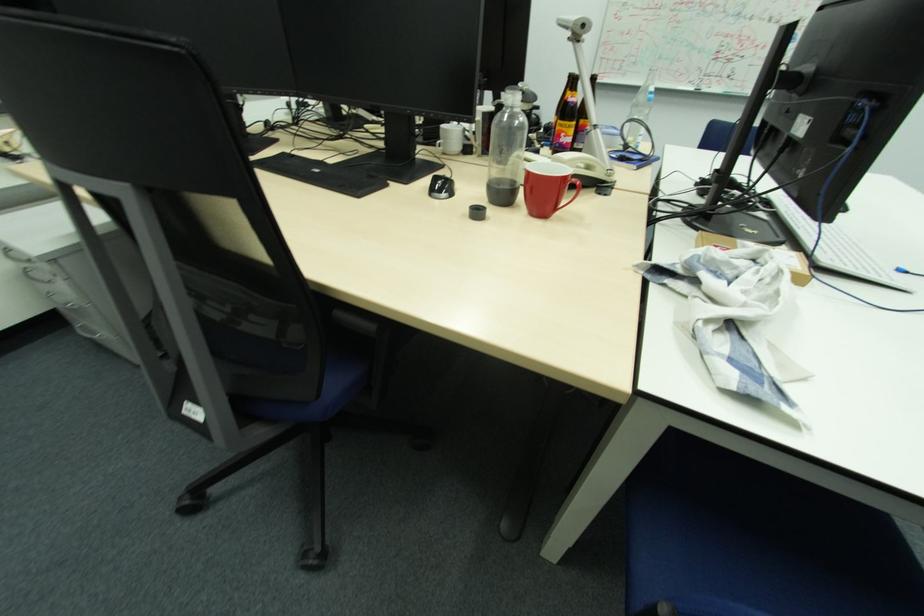
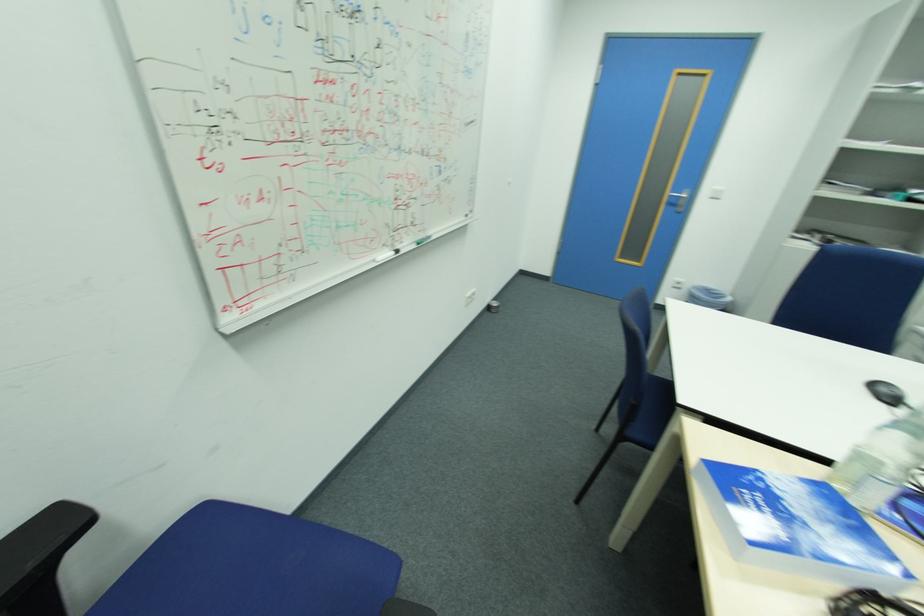
Find the pixel in the second image that matches (x=697, y=91) in the first image.

(396, 256)